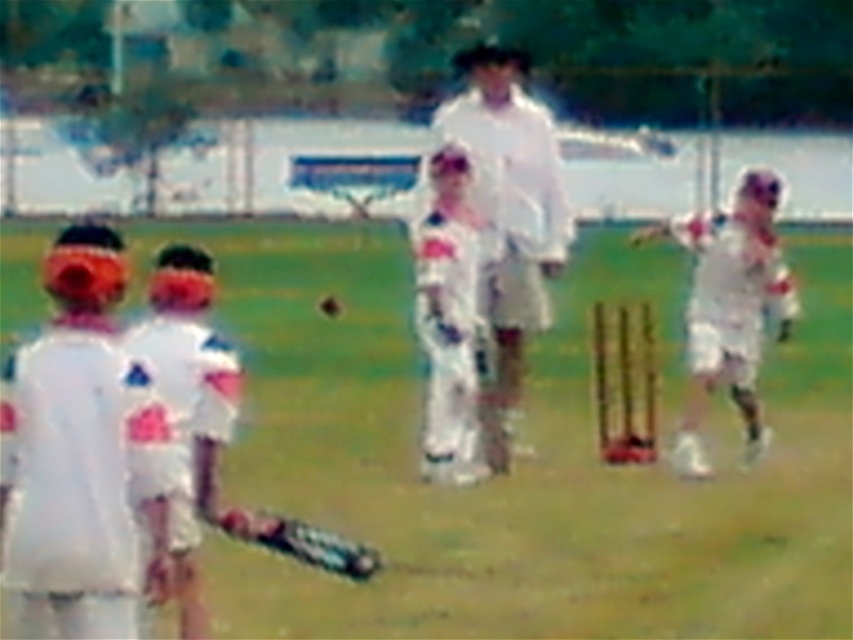
You are a spectator standing at the edge of the cricket field. You notice a specific point marked at coordinates point (83, 465). If you want to throw a ball from your current position to that point, will you have to throw it more than 20 feet?

The distance between point (83, 465) and the viewer is 22.72 feet, which is more than 20 feet. Therefore, you will have to throw the ball more than 20 feet to reach that point.

You are a photographer at the cricket match. You want to take a photo that includes both the white matte cricket bat at left and the white matte cricket uniform at center. Which object should you zoom in on to ensure both are in frame?

The white matte cricket bat at left is smaller than the white matte cricket uniform at center. To include both in the frame, you should zoom out slightly to accommodate the larger size of the white matte cricket uniform at center.

You are a spectator at the cricket match and notice two cricket bats on the field. Which bat is above the other, the white fabric bat at center or the white matte cricket bat at left?

The white fabric bat at center is positioned over the white matte cricket bat at left.